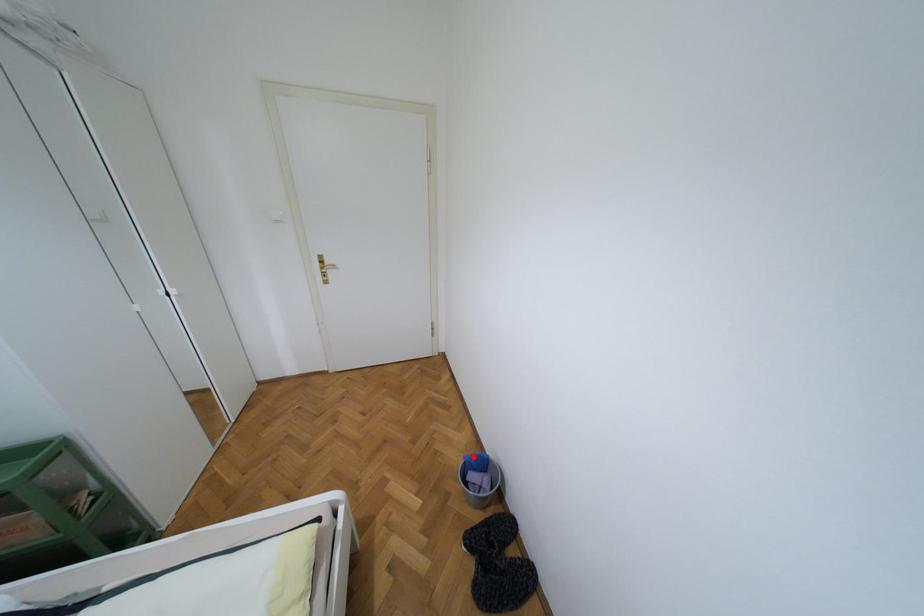
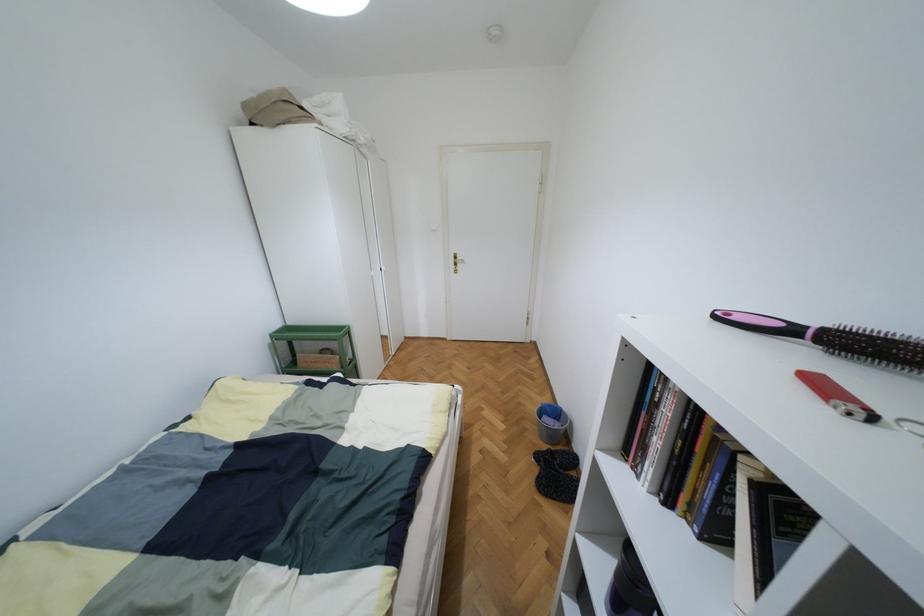
Find the pixel in the second image that matches the highlighted location in the first image.

(549, 406)